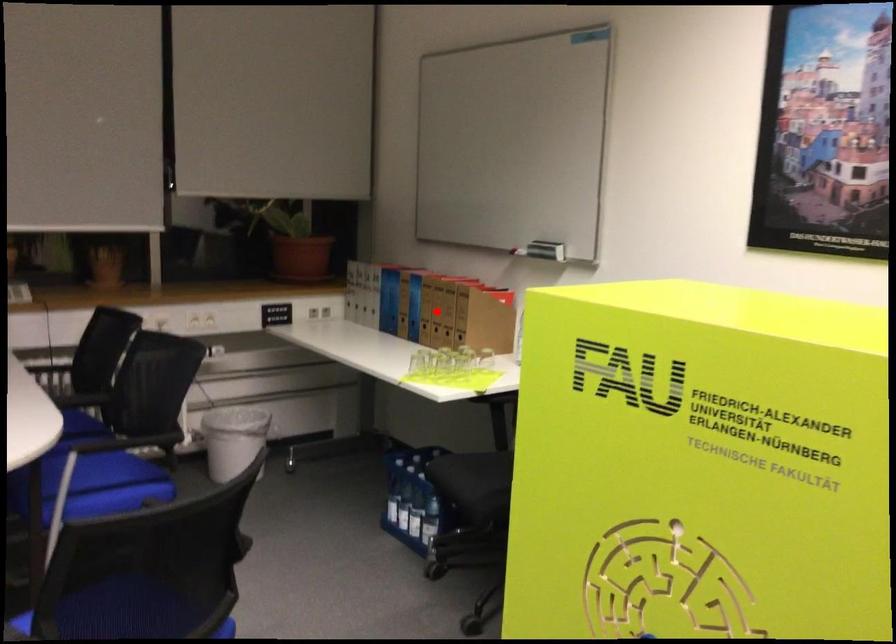
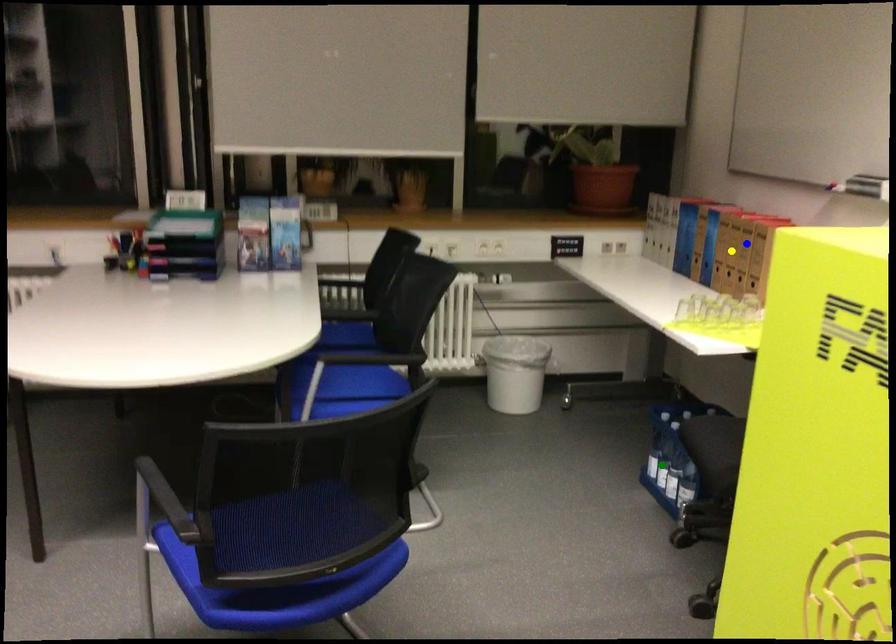
Question: I am providing you with two images of the same scene from different viewpoints. A red point is marked on the first image. You are given multiple points on the second image. Which spot in image 2 lines up with the point in image 1?

Choices:
 (A) blue point
 (B) green point
 (C) yellow point

Answer: (C)